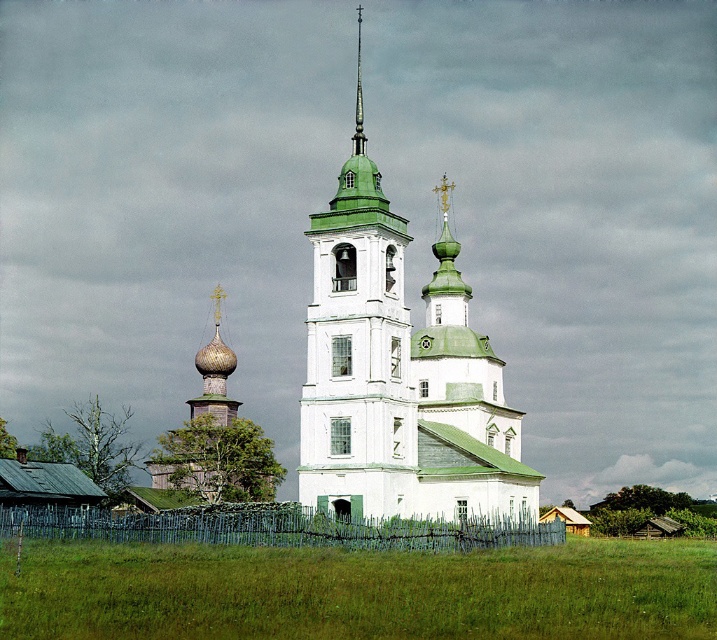
Question: Which of the following is the farthest from the observer?

Choices:
 (A) green grass at lower center
 (B) green wooden fence at lower center
 (C) green wooden bell tower at center

Answer: (C)

Question: Which of these objects is positioned farthest from the white painted wood church at center?

Choices:
 (A) green wooden bell tower at center
 (B) green wooden fence at lower center
 (C) green grass at lower center

Answer: (C)

Question: Is green wooden fence at lower center further to camera compared to green polished dome at upper center?

Choices:
 (A) no
 (B) yes

Answer: (A)

Question: Does white painted wood church at center have a smaller size compared to green polished dome at upper center?

Choices:
 (A) yes
 (B) no

Answer: (B)

Question: Which object is positioned farthest from the green polished dome at upper center?

Choices:
 (A) white painted wood church at center
 (B) green grass at lower center
 (C) green wooden bell tower at center
 (D) green wooden fence at lower center

Answer: (B)

Question: Does green grass at lower center have a larger size compared to green wooden fence at lower center?

Choices:
 (A) no
 (B) yes

Answer: (B)